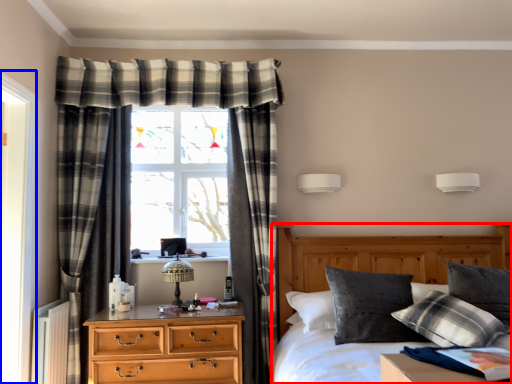
Question: Which object is closer to the camera taking this photo, bed (highlighted by a red box) or screen door (highlighted by a blue box)?

Choices:
 (A) bed
 (B) screen door

Answer: (A)